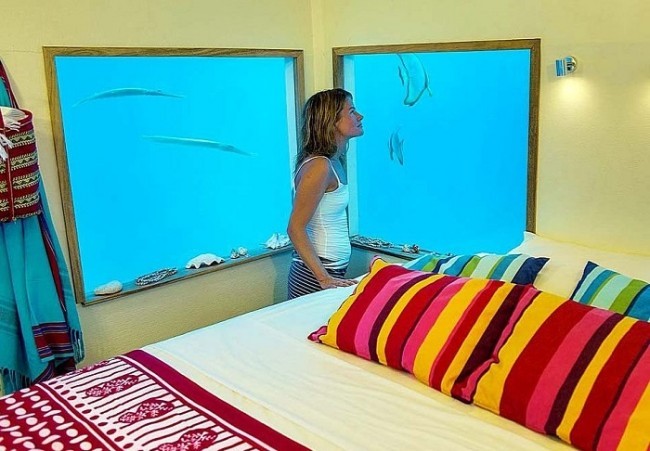
The image size is (650, 451). I want to click on bed, so 247,343.